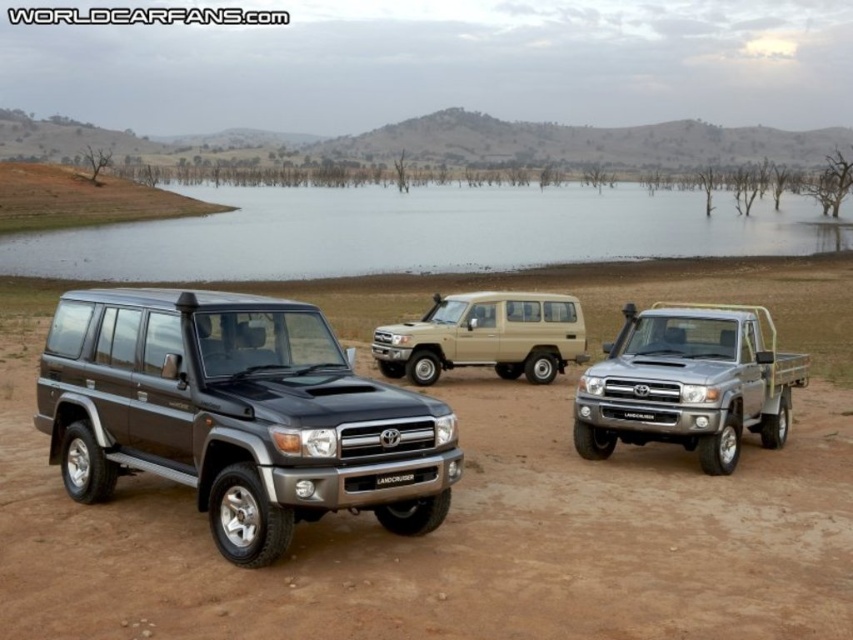
Can you confirm if dark gray metallic suv at center is positioned to the left of beige matte suv at center?

Indeed, dark gray metallic suv at center is positioned on the left side of beige matte suv at center.

Does point (241, 477) come farther from viewer compared to point (498, 362)?

No.

Where is `dark gray metallic suv at center`? Image resolution: width=853 pixels, height=640 pixels. dark gray metallic suv at center is located at coordinates (236, 413).

This screenshot has height=640, width=853. I want to click on dark gray metallic suv at center, so click(236, 413).

Does dark gray metallic suv at center appear on the right side of silver metallic truck at center?

Incorrect, dark gray metallic suv at center is not on the right side of silver metallic truck at center.

The height and width of the screenshot is (640, 853). What are the coordinates of `dark gray metallic suv at center` in the screenshot? It's located at (236, 413).

Between point (256, 376) and point (625, 396), which one is positioned in front?

Point (256, 376) is more forward.

Where is `dark gray metallic suv at center`? The height and width of the screenshot is (640, 853). dark gray metallic suv at center is located at coordinates (236, 413).

How distant is brown matte dirt track at center from clear water at lake center?

brown matte dirt track at center is 208.15 feet away from clear water at lake center.

Between point (680, 566) and point (686, 202), which one is positioned behind?

The point (686, 202) is behind.

Describe the element at coordinates (453, 538) in the screenshot. I see `brown matte dirt track at center` at that location.

Locate an element on the screen. The width and height of the screenshot is (853, 640). brown matte dirt track at center is located at coordinates (453, 538).